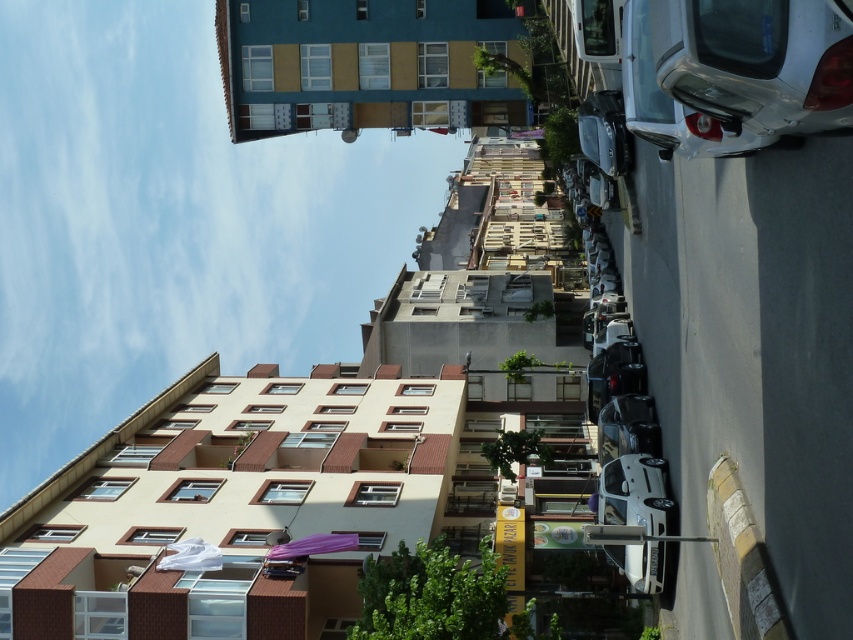
You are standing at the center of the street looking towards the buildings. Where is the white glossy car at right located in relation to your position?

The white glossy car at right is located at the lower right of the image, positioned at coordinates approximately 0.113 on the x axis and 0.860 on the y axis.

You are standing at the point with coordinates (733, 72) in the image. What object is located at that point?

The point at coordinates (733, 72) corresponds to the white glossy car at right.